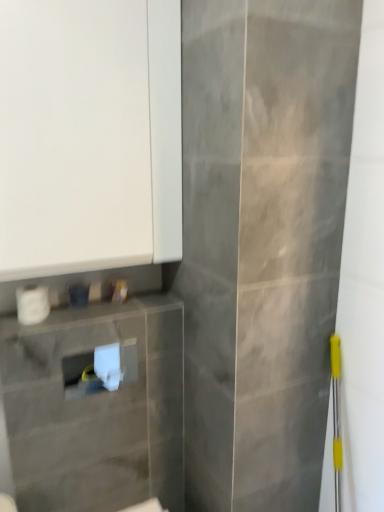
Question: Considering the relative positions of white matte cabinet at upper left and white matte toilet paper at lower left in the image provided, is white matte cabinet at upper left to the left of white matte toilet paper at lower left from the viewer's perspective?

Choices:
 (A) yes
 (B) no

Answer: (B)

Question: Does white matte cabinet at upper left lie behind white matte toilet paper at lower left?

Choices:
 (A) no
 (B) yes

Answer: (A)

Question: Are white matte cabinet at upper left and white matte toilet paper at lower left far apart?

Choices:
 (A) yes
 (B) no

Answer: (B)

Question: Is white matte cabinet at upper left turned away from white matte toilet paper at lower left?

Choices:
 (A) no
 (B) yes

Answer: (A)

Question: Can you confirm if white matte cabinet at upper left is bigger than white matte toilet paper at lower left?

Choices:
 (A) yes
 (B) no

Answer: (A)

Question: Can you confirm if white matte cabinet at upper left is thinner than white matte toilet paper at lower left?

Choices:
 (A) no
 (B) yes

Answer: (A)

Question: Does white matte toilet paper at lower left have a larger size compared to white matte cabinet at upper left?

Choices:
 (A) yes
 (B) no

Answer: (B)

Question: Does white matte toilet paper at lower left turn towards white matte cabinet at upper left?

Choices:
 (A) yes
 (B) no

Answer: (B)

Question: Does white matte toilet paper at lower left have a greater width compared to white matte cabinet at upper left?

Choices:
 (A) no
 (B) yes

Answer: (A)

Question: Is white matte toilet paper at lower left positioned behind white matte cabinet at upper left?

Choices:
 (A) no
 (B) yes

Answer: (B)

Question: Is white matte toilet paper at lower left outside of white matte cabinet at upper left?

Choices:
 (A) yes
 (B) no

Answer: (A)

Question: Does white matte toilet paper at lower left have a lesser width compared to white matte cabinet at upper left?

Choices:
 (A) no
 (B) yes

Answer: (B)

Question: Is point 34,298 closer or farther from the camera than point 69,138?

Choices:
 (A) closer
 (B) farther

Answer: (B)